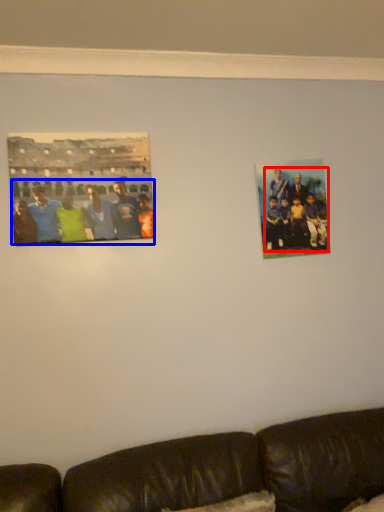
Question: Which of the following is the farthest to the observer, person (highlighted by a red box) or person (highlighted by a blue box)?

Choices:
 (A) person
 (B) person

Answer: (A)